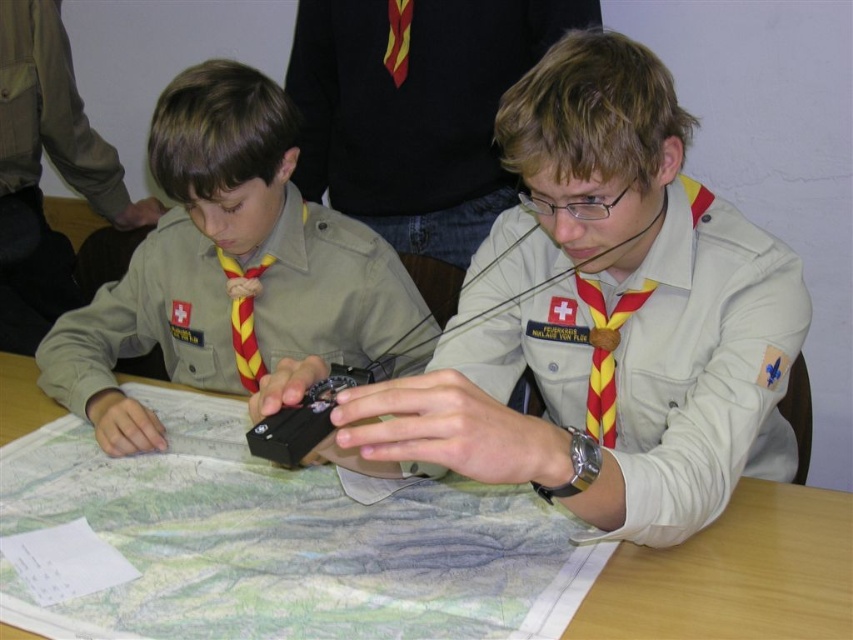
Does matte black compass at left appear on the left side of wooden table at center?

Indeed, matte black compass at left is positioned on the left side of wooden table at center.

Which of these two, matte black compass at left or wooden table at center, stands shorter?

wooden table at center is shorter.

Locate an element on the screen. Image resolution: width=853 pixels, height=640 pixels. matte black compass at left is located at coordinates (227, 266).